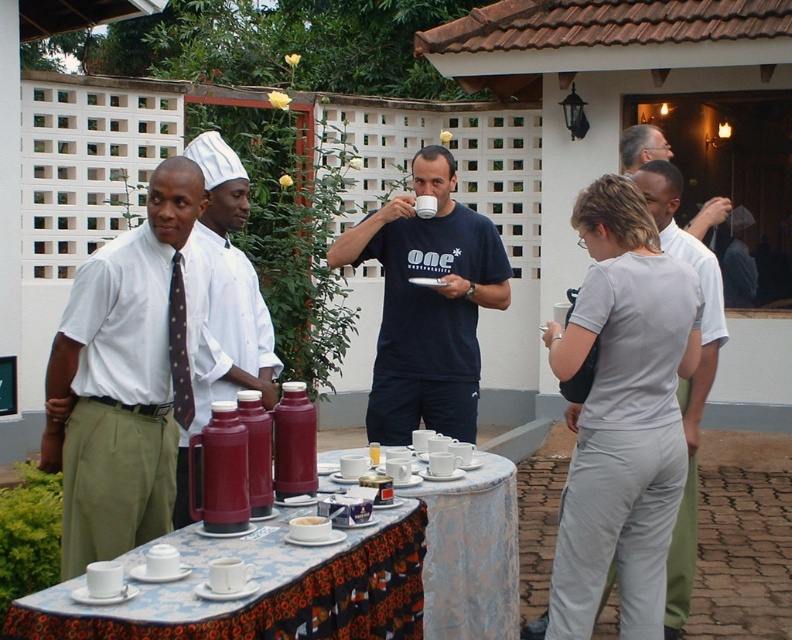
You are taking a photo of the scene and want to focus on both point (143, 273) and point (714, 224). Which point should you adjust your focus to first to ensure both are in focus?

Point (143, 273) is closer to the camera than point (714, 224). To ensure both are in focus, you should focus on the closer point first, which is point (143, 273).